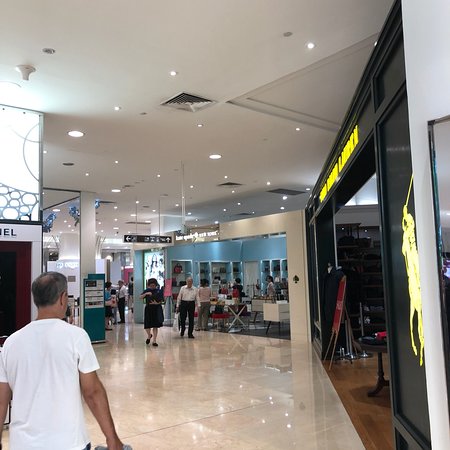
The height and width of the screenshot is (450, 450). I want to click on table, so click(x=381, y=346).